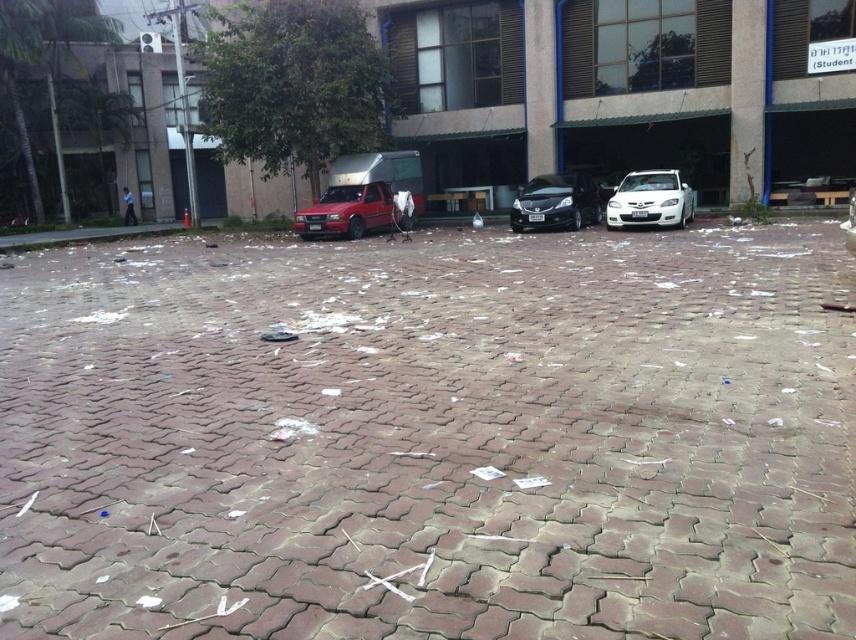
Question: Which of the following is the closest to the observer?

Choices:
 (A) (321, 216)
 (B) (821, 314)
 (C) (685, 224)

Answer: (B)

Question: Is matte red truck at center above satin black car at center?

Choices:
 (A) yes
 (B) no

Answer: (B)

Question: Can you confirm if brick pavement at center is positioned above matte red truck at center?

Choices:
 (A) yes
 (B) no

Answer: (B)

Question: Estimate the real-world distances between objects in this image. Which object is closer to the satin black car at center?

Choices:
 (A) brick pavement at center
 (B) matte red truck at center
 (C) white glossy car at center

Answer: (C)

Question: Which point is closer to the camera?

Choices:
 (A) (676, 220)
 (B) (559, 180)
 (C) (528, 392)

Answer: (C)

Question: Does brick pavement at center have a larger size compared to satin black car at center?

Choices:
 (A) no
 (B) yes

Answer: (B)